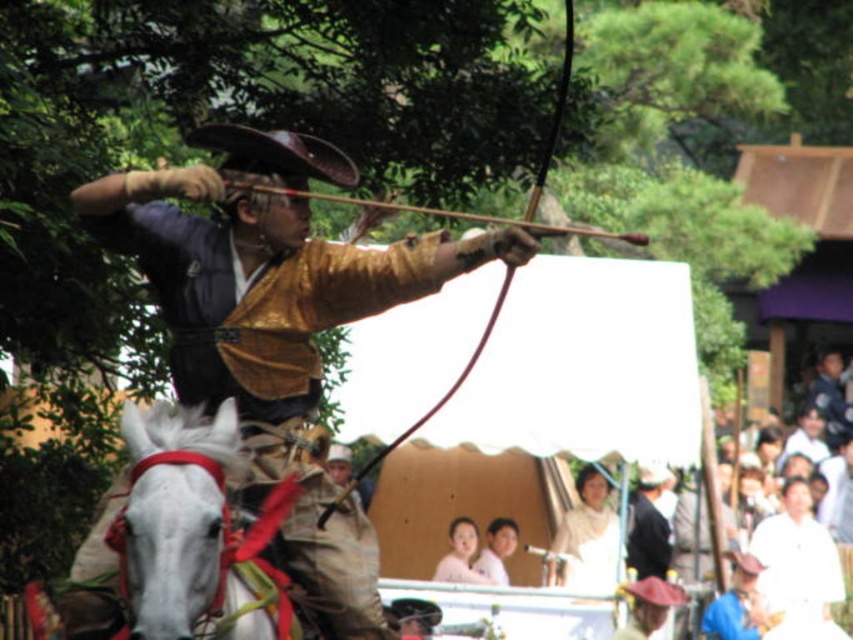
Can you confirm if white cotton kimono at center is positioned below smooth white face at center?

No.

Is point (589, 499) more distant than point (502, 584)?

Yes, point (589, 499) is behind point (502, 584).

Who is more distant from viewer, (589, 573) or (494, 573)?

Point (494, 573)

The width and height of the screenshot is (853, 640). In order to click on white cotton kimono at center in this screenshot , I will do `click(587, 538)`.

Can you confirm if shiny gold jacket at center is thinner than smooth white face at center?

In fact, shiny gold jacket at center might be wider than smooth white face at center.

Between shiny gold jacket at center and smooth white face at center, which one has less height?

With less height is smooth white face at center.

This screenshot has width=853, height=640. Find the location of `shiny gold jacket at center`. shiny gold jacket at center is located at coordinates (276, 320).

Who is higher up, smooth skin face at center or smooth white face at center?

Positioned higher is smooth white face at center.

Is smooth skin face at center shorter than smooth white face at center?

Yes, smooth skin face at center is shorter than smooth white face at center.

Does point (444, 572) come closer to viewer compared to point (483, 561)?

Yes, it is in front of point (483, 561).

This screenshot has height=640, width=853. I want to click on smooth skin face at center, so click(x=460, y=556).